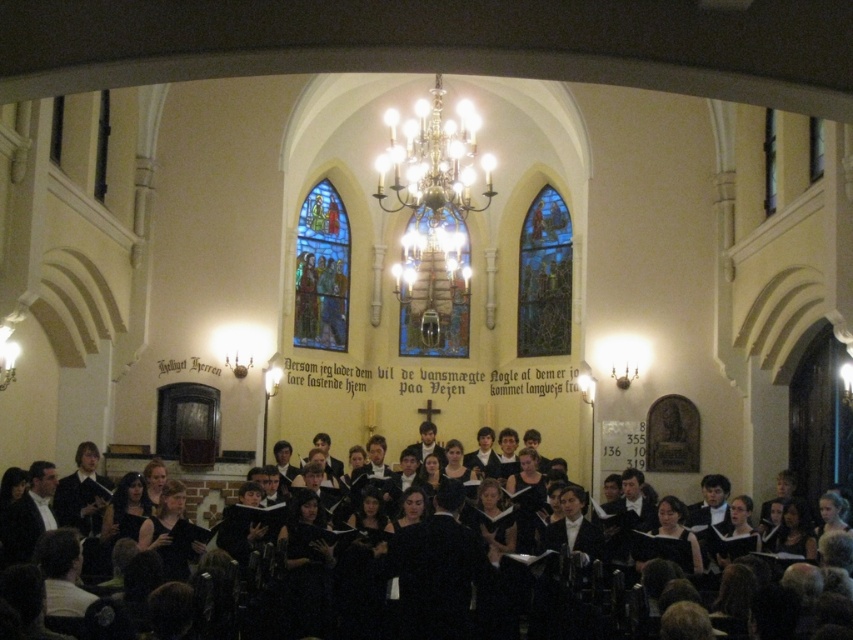
Can you confirm if stained glass window at upper center is positioned to the right of stained glass window at center?

Yes, stained glass window at upper center is to the right of stained glass window at center.

Find the location of a particular element. Image resolution: width=853 pixels, height=640 pixels. stained glass window at upper center is located at coordinates coord(544,276).

Is point (569, 310) positioned in front of point (415, 323)?

Yes, point (569, 310) is closer to viewer.

This screenshot has width=853, height=640. Identify the location of stained glass window at upper center. (544, 276).

The height and width of the screenshot is (640, 853). Describe the element at coordinates (418, 582) in the screenshot. I see `black matte choir robe at center` at that location.

Which of these two, black matte choir robe at center or stained glass window at center, stands taller?

stained glass window at center is taller.

Which is behind, point (770, 611) or point (425, 289)?

The point (425, 289) is behind.

Find the location of a particular element. This screenshot has width=853, height=640. black matte choir robe at center is located at coordinates (418, 582).

Can you confirm if black matte choir robe at center is taller than stained glass window at upper left?

Incorrect, black matte choir robe at center's height is not larger of stained glass window at upper left's.

Image resolution: width=853 pixels, height=640 pixels. Identify the location of black matte choir robe at center. (418, 582).